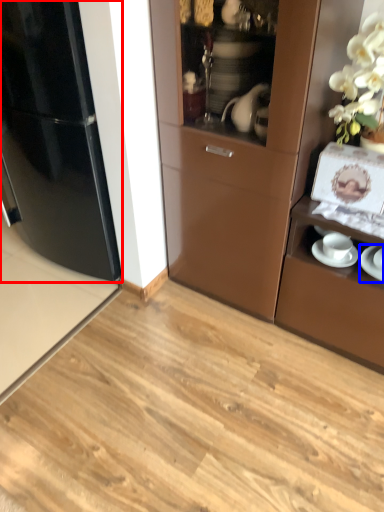
Question: Which object is closer to the camera taking this photo, refrigerator (highlighted by a red box) or saucer (highlighted by a blue box)?

Choices:
 (A) refrigerator
 (B) saucer

Answer: (B)